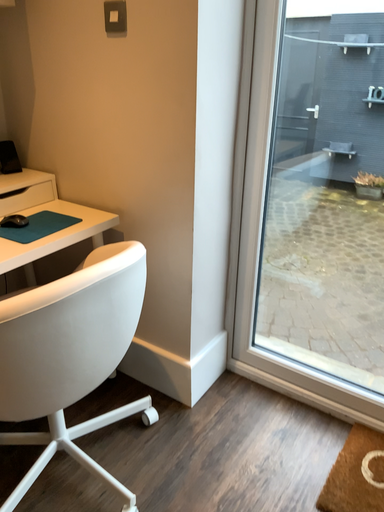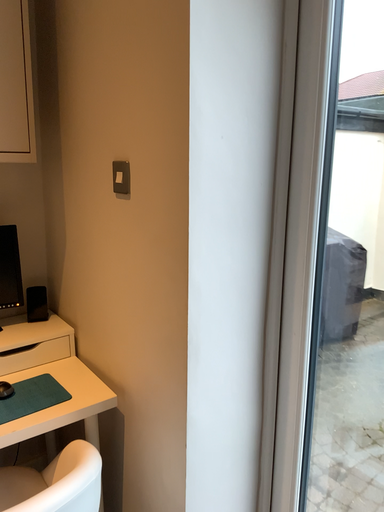
Question: How did the camera likely rotate when shooting the video?

Choices:
 (A) rotated upward
 (B) rotated downward

Answer: (A)